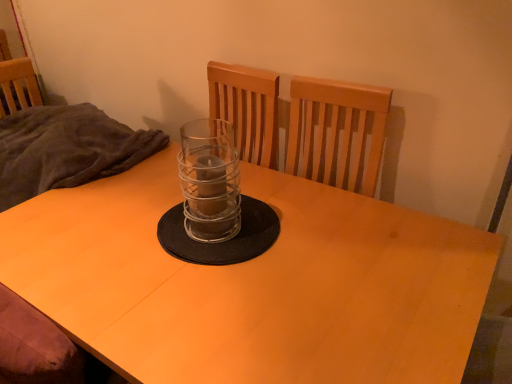
Question: Can you confirm if matte wood desk at center is thinner than clear glass candle holder at center?

Choices:
 (A) yes
 (B) no

Answer: (B)

Question: Is matte wood desk at center next to clear glass candle holder at center?

Choices:
 (A) yes
 (B) no

Answer: (B)

Question: Considering the relative sizes of matte wood desk at center and clear glass candle holder at center in the image provided, is matte wood desk at center smaller than clear glass candle holder at center?

Choices:
 (A) no
 (B) yes

Answer: (A)

Question: From the image's perspective, is matte wood desk at center below clear glass candle holder at center?

Choices:
 (A) no
 (B) yes

Answer: (B)

Question: Considering the relative positions of matte wood desk at center and clear glass candle holder at center in the image provided, is matte wood desk at center to the left of clear glass candle holder at center from the viewer's perspective?

Choices:
 (A) no
 (B) yes

Answer: (A)

Question: Is clear glass candle holder at center located within matte wood desk at center?

Choices:
 (A) yes
 (B) no

Answer: (B)

Question: Can you see clear glass candle holder at center touching dark gray fabric at left?

Choices:
 (A) no
 (B) yes

Answer: (A)

Question: Is clear glass candle holder at center positioned far away from dark gray fabric at left?

Choices:
 (A) no
 (B) yes

Answer: (A)

Question: Does clear glass candle holder at center turn towards dark gray fabric at left?

Choices:
 (A) yes
 (B) no

Answer: (B)

Question: From the image's perspective, is clear glass candle holder at center over dark gray fabric at left?

Choices:
 (A) no
 (B) yes

Answer: (A)

Question: Is clear glass candle holder at center at the left side of dark gray fabric at left?

Choices:
 (A) yes
 (B) no

Answer: (B)

Question: Can you confirm if clear glass candle holder at center is bigger than dark gray fabric at left?

Choices:
 (A) no
 (B) yes

Answer: (A)

Question: Is clear glass candle holder at center wider than matte wood desk at center?

Choices:
 (A) yes
 (B) no

Answer: (B)